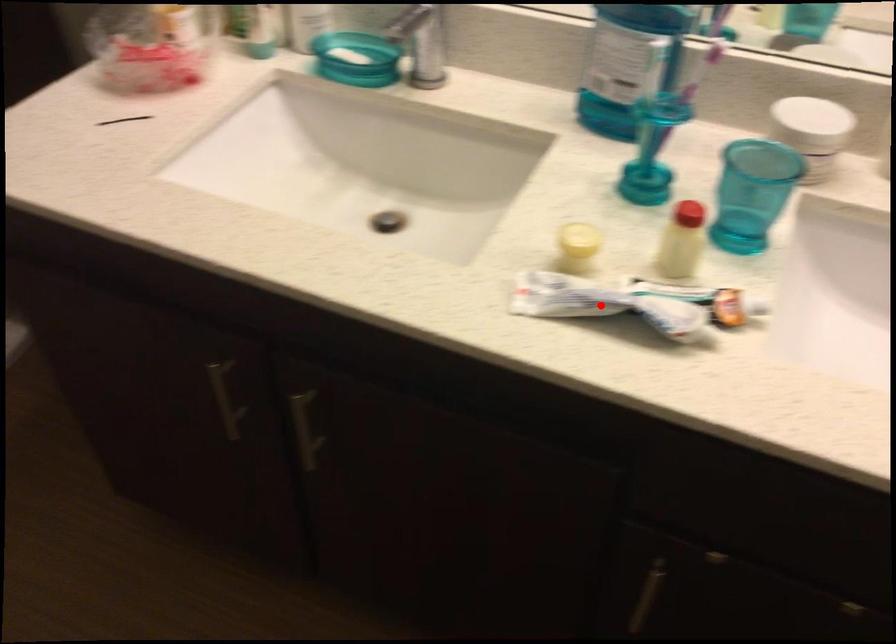
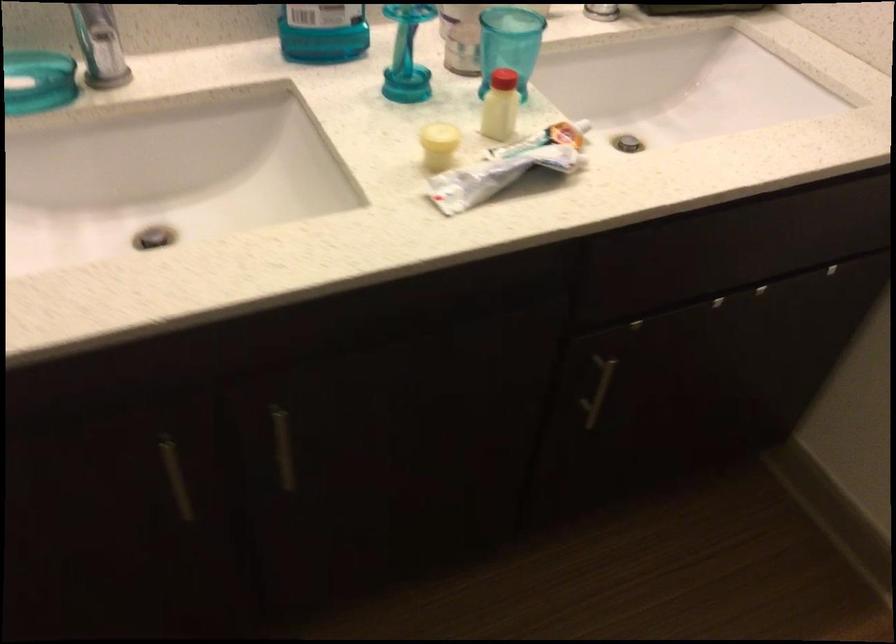
Question: I am providing you with two images of the same scene from different viewpoints. Image1 has a red point marked. In image2, the corresponding 3D location appears at what relative position? Reply with the corresponding letter.

Choices:
 (A) Closer
 (B) Farther

Answer: (B)